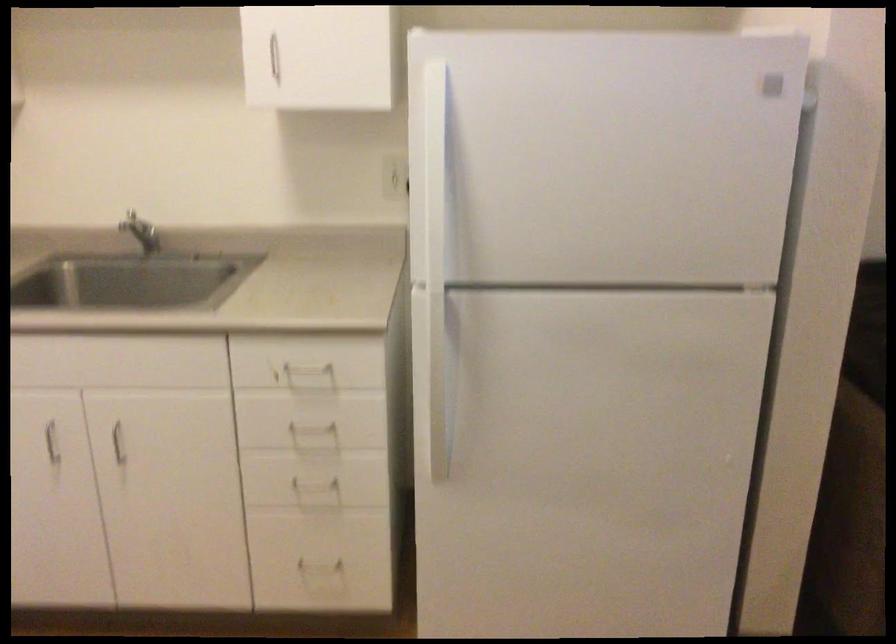
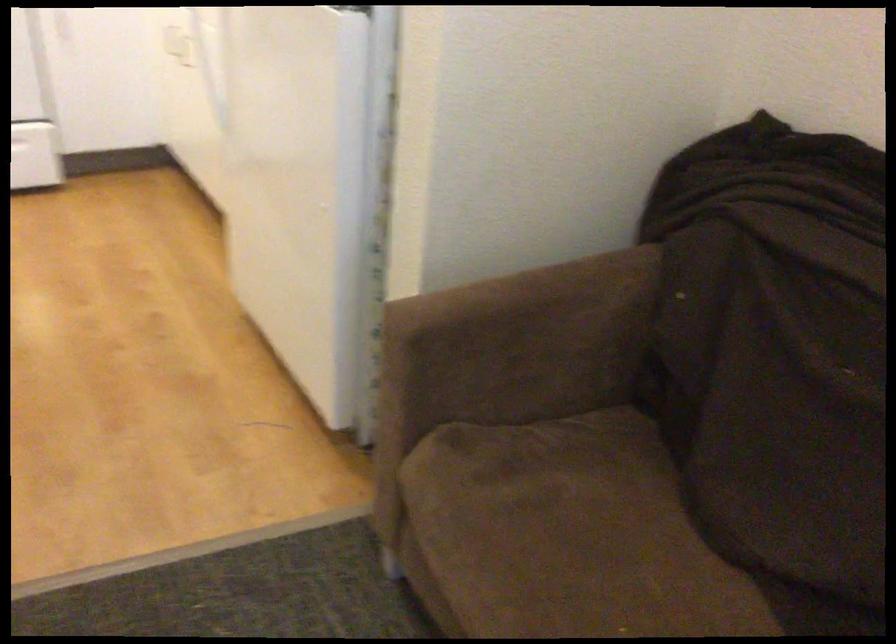
Question: I am providing you with two images of the same scene from different viewpoints. Which of the following objects are not visible in image2?

Choices:
 (A) black keyhole
 (B) white drawer handle
 (C) sofa sitting surface
 (D) brown sofa armrest

Answer: (B)